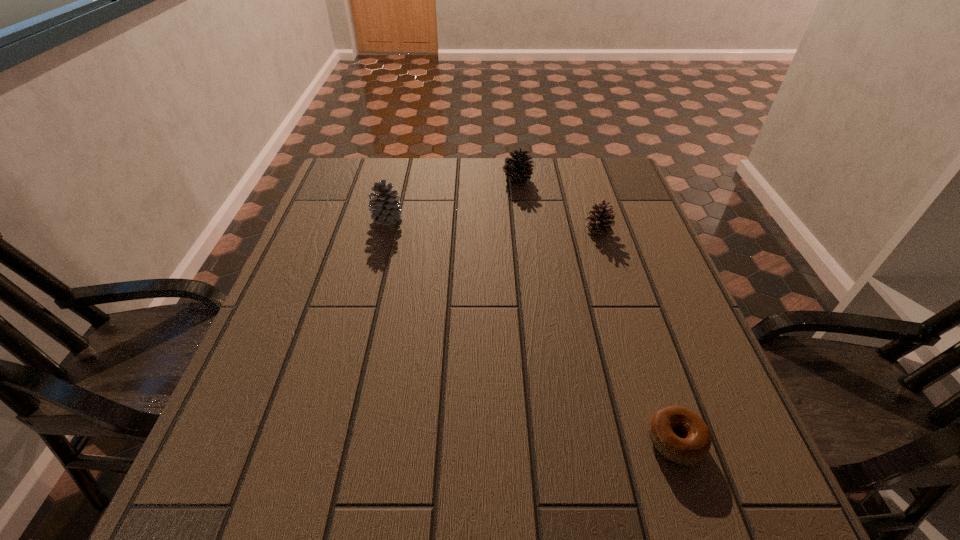
This screenshot has width=960, height=540. I want to click on vacant region between the third object from right to left and the leftmost object, so click(x=452, y=199).

I want to click on vacant space that's between the rightmost pinecone and the second object from left to right, so (x=558, y=204).

Image resolution: width=960 pixels, height=540 pixels. Find the location of `free space between the second shortest pinecone and the shortest object`. free space between the second shortest pinecone and the shortest object is located at coordinates (596, 310).

This screenshot has width=960, height=540. What are the coordinates of `unoccupied area between the shortest object and the rightmost pinecone` in the screenshot? It's located at (636, 335).

This screenshot has height=540, width=960. I want to click on object that can be found as the closest to the leftmost pinecone, so click(518, 168).

Where is `object that is the third closest to the bagel`? object that is the third closest to the bagel is located at coordinates (518, 168).

You are a GUI agent. You are given a task and a screenshot of the screen. Output one action in this format:
    pyautogui.click(x=<x>, y=<y>)
    Task: Click on the pinecone that is the closest to the second pinecone from left to right
    
    Given the screenshot: What is the action you would take?
    pyautogui.click(x=599, y=222)

Find the location of a particular element. This screenshot has width=960, height=540. pinecone that is the second nearest to the shortest pinecone is located at coordinates (384, 206).

You are a GUI agent. You are given a task and a screenshot of the screen. Output one action in this format:
    pyautogui.click(x=<x>, y=<y>)
    Task: Click on the free space that satisfies the following two spatial constraints: 1. on the back side of the second tallest object; 2. on the left side of the leftmost pinecone
    The image size is (960, 540).
    Given the screenshot: What is the action you would take?
    pyautogui.click(x=397, y=179)

I want to click on free point that satisfies the following two spatial constraints: 1. on the front side of the leftmost pinecone; 2. on the right side of the rightmost pinecone, so click(x=385, y=228).